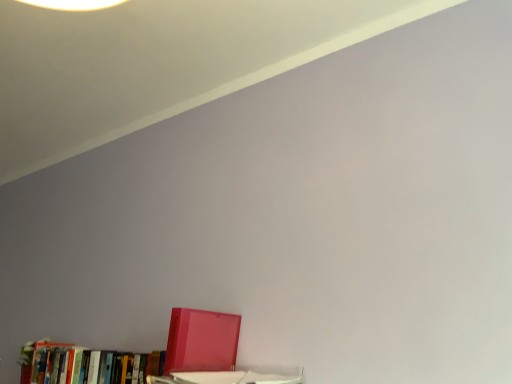
This screenshot has height=384, width=512. Describe the element at coordinates (201, 341) in the screenshot. I see `glossy plastic binder at lower left, acting as the first book starting from the right` at that location.

What are the coordinates of `glossy plastic binder at lower left, acting as the 2th book starting from the left` in the screenshot? It's located at (201, 341).

Where is `matte red book at lower left, the second book in the right-to-left sequence`? The image size is (512, 384). matte red book at lower left, the second book in the right-to-left sequence is located at coordinates (89, 365).

Measure the distance between point (124,369) and camera.

Point (124,369) and camera are 4.60 feet apart from each other.

Describe the element at coordinates (89, 365) in the screenshot. The width and height of the screenshot is (512, 384). I see `matte red book at lower left, the second book in the right-to-left sequence` at that location.

Where is `glossy plastic binder at lower left, acting as the first book starting from the right`? The height and width of the screenshot is (384, 512). glossy plastic binder at lower left, acting as the first book starting from the right is located at coordinates (201, 341).

Considering the positions of objects matte red book at lower left, placed as the first book when sorted from left to right, and glossy plastic binder at lower left, acting as the first book starting from the right, in the image provided, who is more to the right, matte red book at lower left, placed as the first book when sorted from left to right, or glossy plastic binder at lower left, acting as the first book starting from the right,?

glossy plastic binder at lower left, acting as the first book starting from the right, is more to the right.

Between matte red book at lower left, placed as the first book when sorted from left to right, and glossy plastic binder at lower left, acting as the first book starting from the right, which one is positioned in front?

glossy plastic binder at lower left, acting as the first book starting from the right, is in front.

Which is behind, point (148, 359) or point (191, 325)?

Positioned behind is point (148, 359).

From the image's perspective, would you say matte red book at lower left, the second book in the right-to-left sequence, is shown under glossy plastic binder at lower left, acting as the 2th book starting from the left?

Yes, from the image's perspective, matte red book at lower left, the second book in the right-to-left sequence, is beneath glossy plastic binder at lower left, acting as the 2th book starting from the left.

From a real-world perspective, is matte red book at lower left, placed as the first book when sorted from left to right, below glossy plastic binder at lower left, acting as the 2th book starting from the left?

Indeed, from a real-world perspective, matte red book at lower left, placed as the first book when sorted from left to right, is positioned beneath glossy plastic binder at lower left, acting as the 2th book starting from the left.

Looking at their sizes, would you say matte red book at lower left, the second book in the right-to-left sequence, is wider or thinner than glossy plastic binder at lower left, acting as the first book starting from the right?

Clearly, matte red book at lower left, the second book in the right-to-left sequence, has less width compared to glossy plastic binder at lower left, acting as the first book starting from the right.

In the scene shown: Is matte red book at lower left, placed as the first book when sorted from left to right, shorter than glossy plastic binder at lower left, acting as the first book starting from the right?

Correct, matte red book at lower left, placed as the first book when sorted from left to right, is not as tall as glossy plastic binder at lower left, acting as the first book starting from the right.

Between matte red book at lower left, placed as the first book when sorted from left to right, and glossy plastic binder at lower left, acting as the first book starting from the right, which one has smaller size?

With smaller size is glossy plastic binder at lower left, acting as the first book starting from the right.

Does matte red book at lower left, the second book in the right-to-left sequence, contain glossy plastic binder at lower left, acting as the 2th book starting from the left?

No, glossy plastic binder at lower left, acting as the 2th book starting from the left, is not inside matte red book at lower left, the second book in the right-to-left sequence.

Would you say matte red book at lower left, placed as the first book when sorted from left to right, is a long distance from glossy plastic binder at lower left, acting as the 2th book starting from the left?

Actually, matte red book at lower left, placed as the first book when sorted from left to right, and glossy plastic binder at lower left, acting as the 2th book starting from the left, are a little close together.

Is matte red book at lower left, placed as the first book when sorted from left to right, turned away from glossy plastic binder at lower left, acting as the 2th book starting from the left?

That's not correct — matte red book at lower left, placed as the first book when sorted from left to right, is not looking away from glossy plastic binder at lower left, acting as the 2th book starting from the left.

Find the location of a particular element. This screenshot has height=384, width=512. book in front of the matte red book at lower left, the second book in the right-to-left sequence is located at coordinates (201, 341).

In the scene shown: Which object is positioned more to the left, glossy plastic binder at lower left, acting as the 2th book starting from the left, or matte red book at lower left, the second book in the right-to-left sequence?

From the viewer's perspective, matte red book at lower left, the second book in the right-to-left sequence, appears more on the left side.

Does glossy plastic binder at lower left, acting as the first book starting from the right, come behind matte red book at lower left, the second book in the right-to-left sequence?

No, the depth of glossy plastic binder at lower left, acting as the first book starting from the right, is less than that of matte red book at lower left, the second book in the right-to-left sequence.

Which is farther, (192, 365) or (127, 379)?

Point (127, 379)

From the image's perspective, who appears lower, glossy plastic binder at lower left, acting as the first book starting from the right, or matte red book at lower left, placed as the first book when sorted from left to right?

matte red book at lower left, placed as the first book when sorted from left to right, from the image's perspective.

From a real-world perspective, is glossy plastic binder at lower left, acting as the first book starting from the right, physically below matte red book at lower left, the second book in the right-to-left sequence?

No, from a real-world perspective, glossy plastic binder at lower left, acting as the first book starting from the right, is not beneath matte red book at lower left, the second book in the right-to-left sequence.

Considering the sizes of objects glossy plastic binder at lower left, acting as the 2th book starting from the left, and matte red book at lower left, placed as the first book when sorted from left to right, in the image provided, who is wider, glossy plastic binder at lower left, acting as the 2th book starting from the left, or matte red book at lower left, placed as the first book when sorted from left to right,?

glossy plastic binder at lower left, acting as the 2th book starting from the left, is wider.

Does glossy plastic binder at lower left, acting as the 2th book starting from the left, have a greater height compared to matte red book at lower left, placed as the first book when sorted from left to right?

Correct, glossy plastic binder at lower left, acting as the 2th book starting from the left, is much taller as matte red book at lower left, placed as the first book when sorted from left to right.

Considering the relative sizes of glossy plastic binder at lower left, acting as the first book starting from the right, and matte red book at lower left, placed as the first book when sorted from left to right, in the image provided, is glossy plastic binder at lower left, acting as the first book starting from the right, bigger than matte red book at lower left, placed as the first book when sorted from left to right,?

No.

Is glossy plastic binder at lower left, acting as the first book starting from the right, spatially inside matte red book at lower left, placed as the first book when sorted from left to right, or outside of it?

glossy plastic binder at lower left, acting as the first book starting from the right, cannot be found inside matte red book at lower left, placed as the first book when sorted from left to right.

Is glossy plastic binder at lower left, acting as the 2th book starting from the left, directly adjacent to matte red book at lower left, the second book in the right-to-left sequence?

No.

Is glossy plastic binder at lower left, acting as the 2th book starting from the left, facing towards matte red book at lower left, placed as the first book when sorted from left to right?

No, glossy plastic binder at lower left, acting as the 2th book starting from the left, is not aimed at matte red book at lower left, placed as the first book when sorted from left to right.

How different are the orientations of glossy plastic binder at lower left, acting as the first book starting from the right, and matte red book at lower left, the second book in the right-to-left sequence, in degrees?

The facing directions of glossy plastic binder at lower left, acting as the first book starting from the right, and matte red book at lower left, the second book in the right-to-left sequence, are 0.697 degrees apart.

At what (x,y) coordinates should I click in order to perform the action: click on book located above the matte red book at lower left, placed as the first book when sorted from left to right (from the image's perspective). Please return your answer as a coordinate pair (x, y). Looking at the image, I should click on (201, 341).

Locate an element on the screen. The width and height of the screenshot is (512, 384). book lying on the left of glossy plastic binder at lower left, acting as the first book starting from the right is located at coordinates (89, 365).

Identify the location of book on the right of matte red book at lower left, the second book in the right-to-left sequence. This screenshot has width=512, height=384. (201, 341).